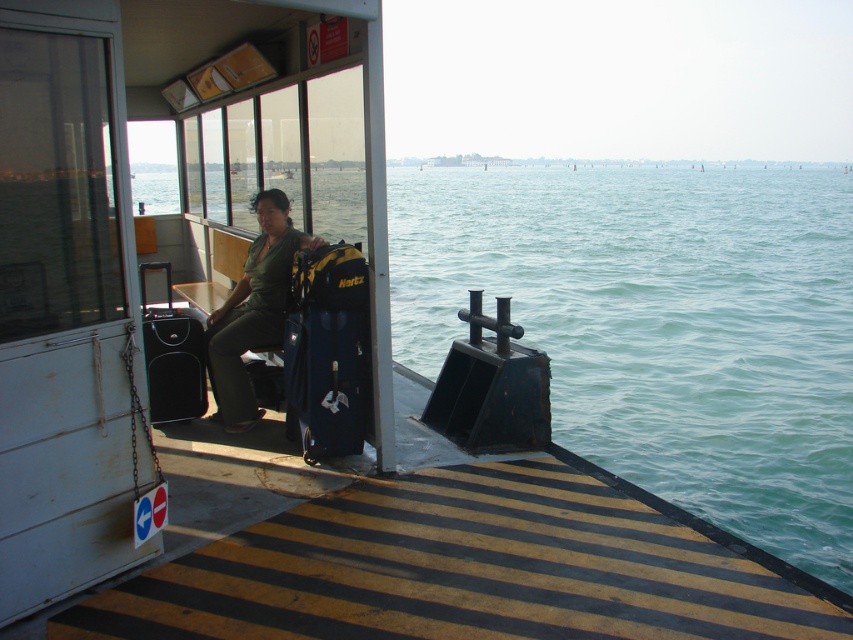
Is green matte shirt at center positioned in front of black fabric suitcase at left?

Yes, green matte shirt at center is in front of black fabric suitcase at left.

Is point (225, 355) less distant than point (165, 344)?

Yes.

Identify the location of green matte shirt at center. (253, 308).

Can you confirm if matte blue luggage at center is positioned to the left of black fabric suitcase at left?

In fact, matte blue luggage at center is to the right of black fabric suitcase at left.

Based on the photo, how distant is matte blue luggage at center from black fabric suitcase at left?

The distance of matte blue luggage at center from black fabric suitcase at left is 3.92 feet.

Which is in front, point (297, 273) or point (198, 392)?

Point (297, 273) is more forward.

You are a GUI agent. You are given a task and a screenshot of the screen. Output one action in this format:
    pyautogui.click(x=<x>, y=<y>)
    Task: Click on the matte blue luggage at center
    This screenshot has height=640, width=853.
    Given the screenshot: What is the action you would take?
    tap(328, 349)

Who is positioned more to the right, matte blue luggage at center or green matte shirt at center?

From the viewer's perspective, matte blue luggage at center appears more on the right side.

Which of these two, matte blue luggage at center or green matte shirt at center, stands taller?

green matte shirt at center

Between point (349, 289) and point (228, 300), which one is positioned behind?

The point (228, 300) is more distant.

You are a GUI agent. You are given a task and a screenshot of the screen. Output one action in this format:
    pyautogui.click(x=<x>, y=<y>)
    Task: Click on the matte blue luggage at center
    The image size is (853, 640).
    Given the screenshot: What is the action you would take?
    pyautogui.click(x=328, y=349)